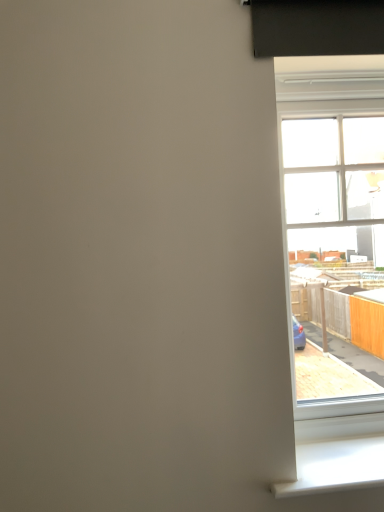
This screenshot has width=384, height=512. In order to click on clear glass window at right in this screenshot , I will do `click(331, 179)`.

What do you see at coordinates (331, 179) in the screenshot? I see `clear glass window at right` at bounding box center [331, 179].

I want to click on clear glass window at right, so click(x=331, y=179).